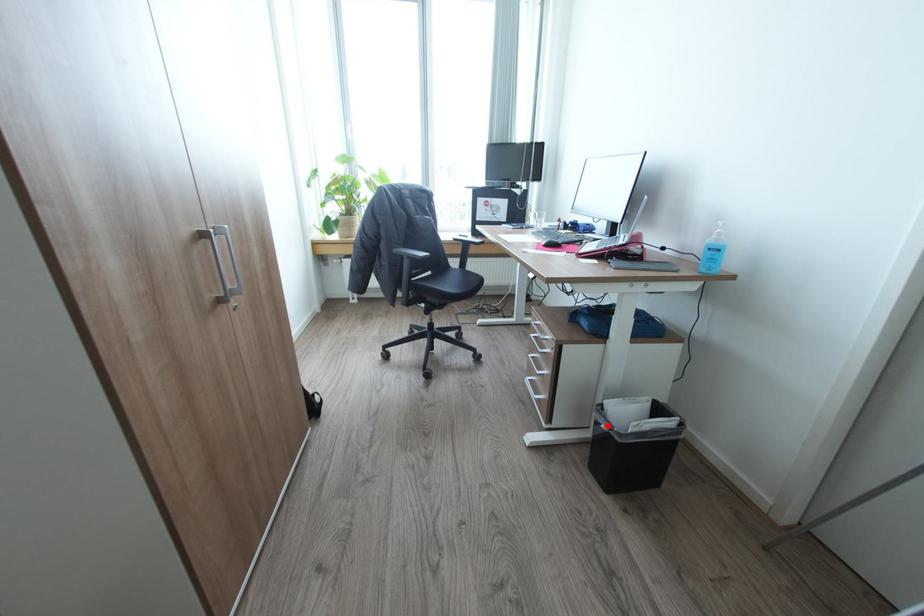
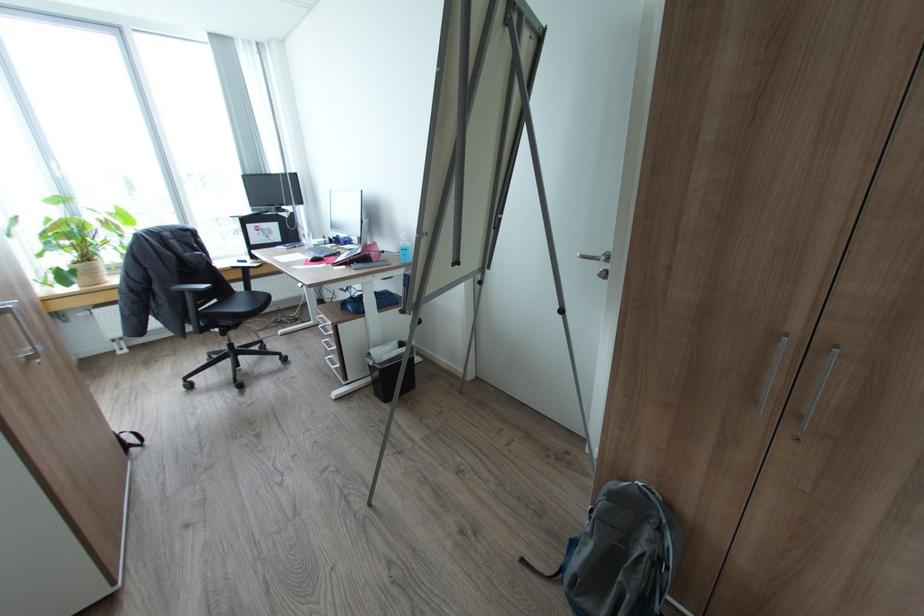
In the second image, find the point that corresponds to the highlighted location in the first image.

(374, 363)